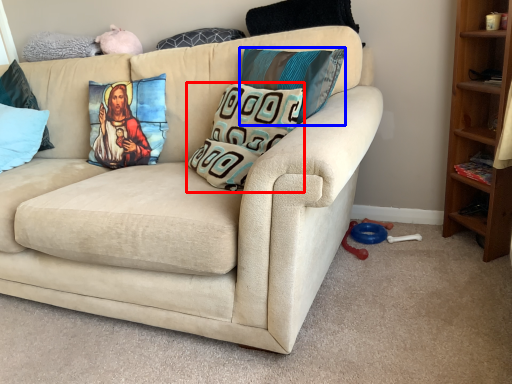
Question: Which point is closer to the camera, pillow (highlighted by a red box) or pillow (highlighted by a blue box)?

Choices:
 (A) pillow
 (B) pillow

Answer: (A)